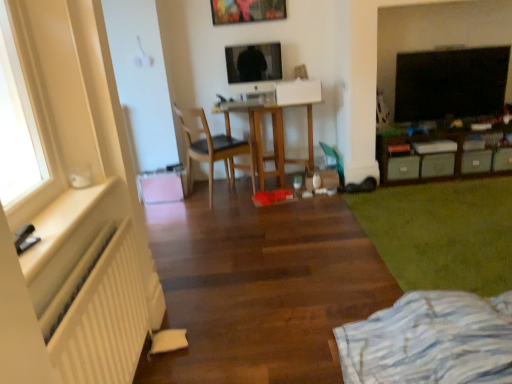
Where is `free location in front of green matte drawer at right, which is the 4th drawer from right to left`? This screenshot has height=384, width=512. free location in front of green matte drawer at right, which is the 4th drawer from right to left is located at coordinates (413, 187).